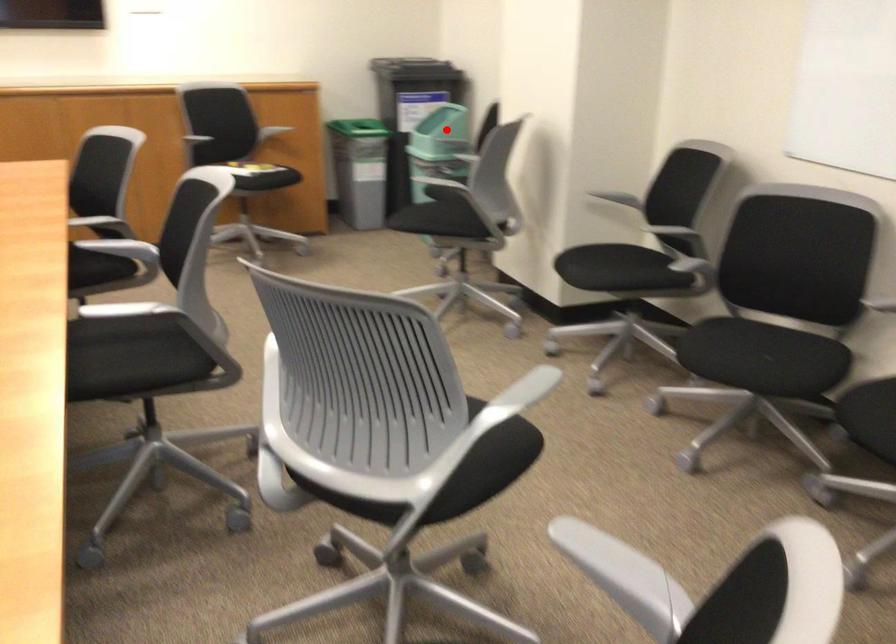
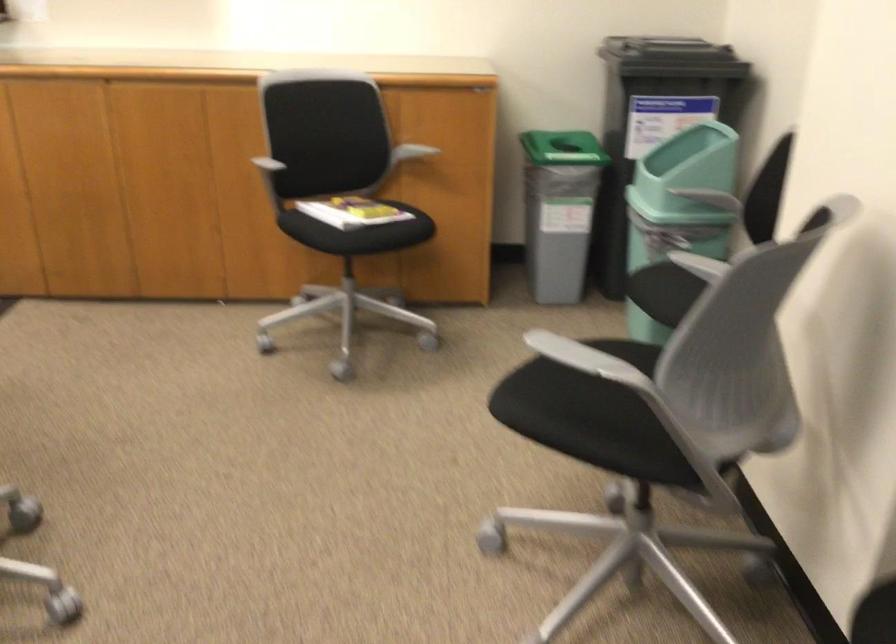
Question: A red point is marked in image1. In image2, is the corresponding 3D point closer to the camera or farther? Reply with the corresponding letter.

Choices:
 (A) The corresponding 3D point is closer.
 (B) The corresponding 3D point is farther.

Answer: (A)